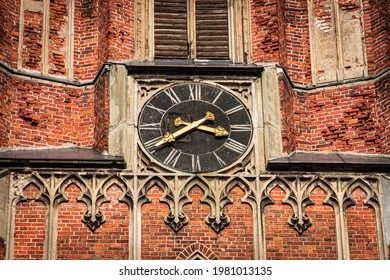
Locate an element on the screen. clock mintue hand is located at coordinates (180, 131).